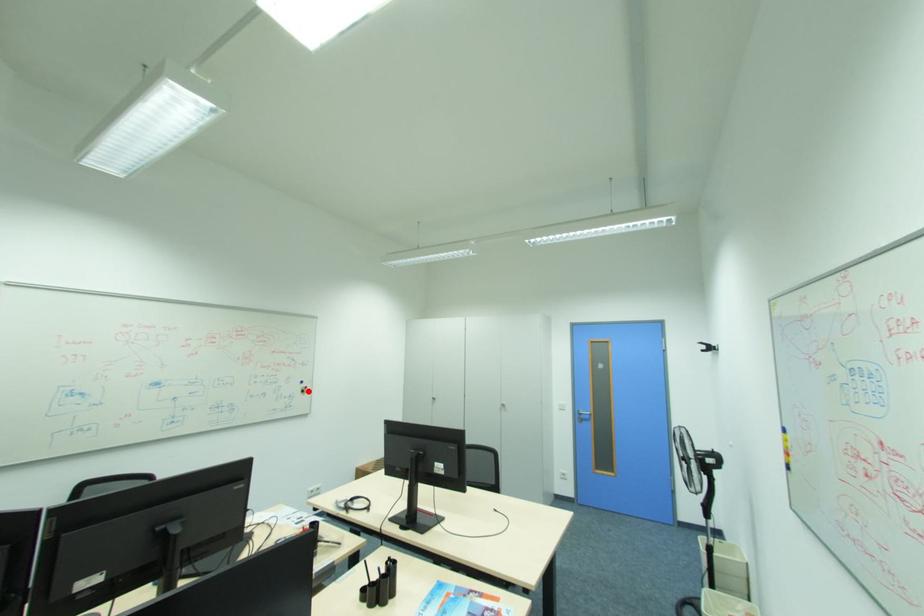
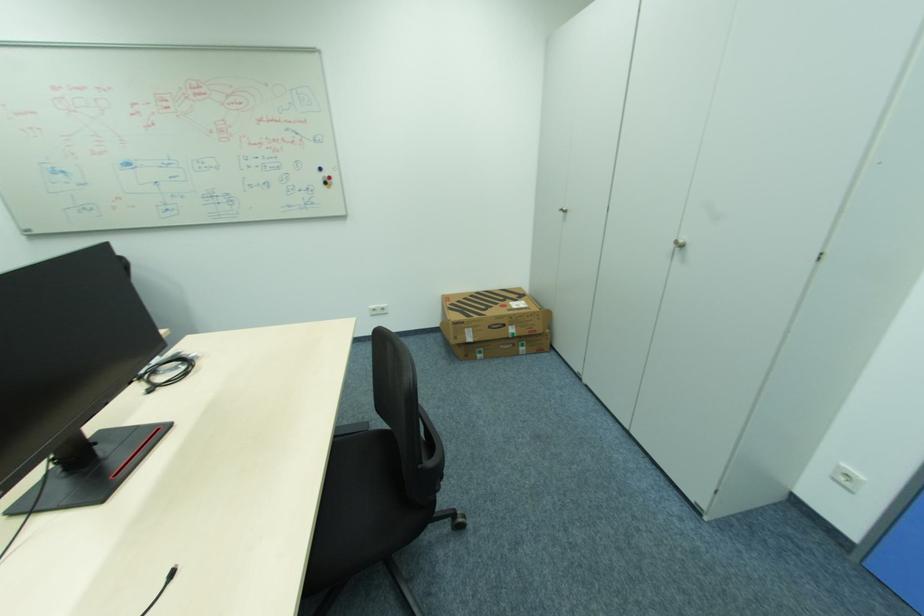
Locate, in the second image, the point that corresponds to the highlighted location in the first image.

(331, 184)